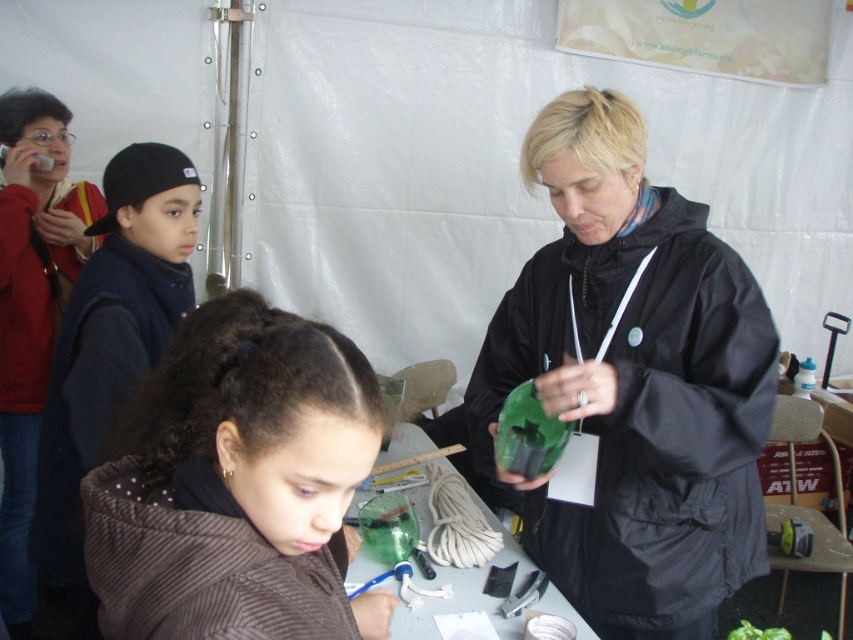
You are at an event and need to locate the green matte mask at center and the black fleece jacket at left. Based on the scene description, which object is positioned to the right of the other?

The green matte mask at center is to the right of the black fleece jacket at left.